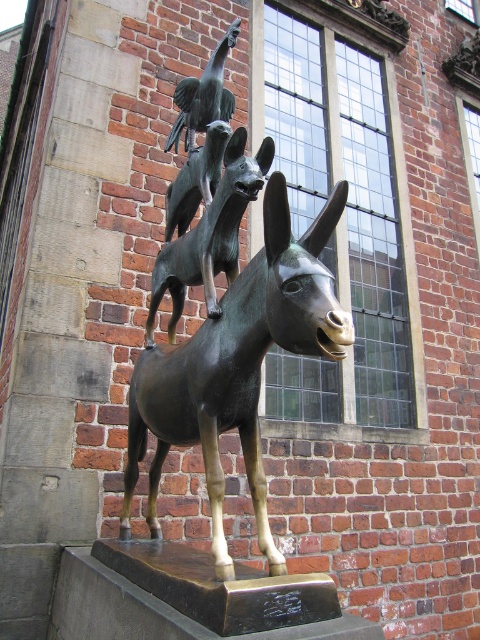
Is bronze/statue at center to the right of bronze statue at upper center from the viewer's perspective?

In fact, bronze/statue at center is to the left of bronze statue at upper center.

In the scene shown: Which is below, bronze/statue at center or bronze statue at upper center?

bronze/statue at center is below.

Who is more distant from viewer, (248, 177) or (189, 84)?

The point (189, 84) is more distant.

In order to click on bronze/statue at center in this screenshot , I will do `click(210, 236)`.

Between point (165, 285) and point (168, 211), which one is positioned in front?

Point (165, 285) is in front.

Is bronze/statue at center closer to camera compared to bronze bird at center?

Yes, bronze/statue at center is in front of bronze bird at center.

Image resolution: width=480 pixels, height=640 pixels. Identify the location of bronze/statue at center. (210, 236).

Which is above, bronze horse at center or bronze statue at upper center?

Positioned higher is bronze statue at upper center.

Does bronze horse at center have a lesser width compared to bronze statue at upper center?

Incorrect, bronze horse at center's width is not less than bronze statue at upper center's.

What do you see at coordinates (237, 365) in the screenshot? I see `bronze horse at center` at bounding box center [237, 365].

In order to click on bronze horse at center in this screenshot , I will do `click(237, 365)`.